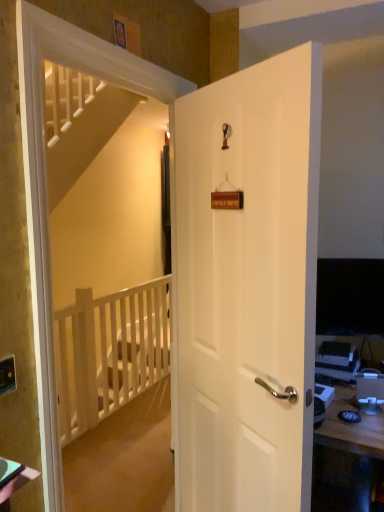
The image size is (384, 512). Describe the element at coordinates (370, 392) in the screenshot. I see `matte black desktop computer at right` at that location.

Image resolution: width=384 pixels, height=512 pixels. What do you see at coordinates (247, 286) in the screenshot?
I see `white matte door at center` at bounding box center [247, 286].

Where is `white wooden balustrade at left`? white wooden balustrade at left is located at coordinates (109, 352).

This screenshot has width=384, height=512. Identify the location of matte black desktop computer at right. (370, 392).

Is matte black outlet at lower left to the right of white matte door at center from the viewer's perspective?

No.

Relative to white matte door at center, is matte black outlet at lower left in front or behind?

Clearly, matte black outlet at lower left is in front of white matte door at center.

Is matte black outlet at lower left inside the boundaries of white matte door at center, or outside?

The correct answer is: outside.

Can you confirm if matte black outlet at lower left is taller than white matte door at center?

Incorrect, the height of matte black outlet at lower left is not larger of that of white matte door at center.

Who is taller, white wooden balustrade at left or matte black desktop computer at right?

white wooden balustrade at left.

Consider the image. In terms of width, does white wooden balustrade at left look wider or thinner when compared to matte black desktop computer at right?

In the image, white wooden balustrade at left appears to be wider than matte black desktop computer at right.

Is white wooden balustrade at left far from matte black desktop computer at right?

Yes, white wooden balustrade at left and matte black desktop computer at right are located far from each other.

How different are the orientations of white wooden balustrade at left and matte black desktop computer at right in degrees?

white wooden balustrade at left and matte black desktop computer at right are facing 72.8 degrees away from each other.

Is matte black outlet at lower left positioned with its back to white wooden balustrade at left?

No, white wooden balustrade at left is not at the back of matte black outlet at lower left.

Can you confirm if matte black outlet at lower left is wider than white wooden balustrade at left?

No, matte black outlet at lower left is not wider than white wooden balustrade at left.

Between matte black outlet at lower left and white wooden balustrade at left, which one has larger size?

white wooden balustrade at left.

From a real-world perspective, which is physically above, matte black outlet at lower left or white wooden balustrade at left?

matte black outlet at lower left is physically above.

Based on the photo, visually, is white matte door at center positioned to the left or to the right of matte black desktop computer at right?

Based on their positions, white matte door at center is located to the left of matte black desktop computer at right.

This screenshot has height=512, width=384. I want to click on door lying above the matte black desktop computer at right (from the image's perspective), so click(x=247, y=286).

Is point (233, 509) positioned in front of point (375, 392)?

Yes, it is.

From the image's perspective, which is below, white matte door at center or matte black desktop computer at right?

matte black desktop computer at right is shown below in the image.

From the image's perspective, between white matte door at center and matte black outlet at lower left, which one is located above?

matte black outlet at lower left.

From a real-world perspective, which object rests below the other?

In real-world perspective, white matte door at center is lower.

Which object is positioned more to the right, white matte door at center or matte black outlet at lower left?

From the viewer's perspective, white matte door at center appears more on the right side.

Can you tell me how much white matte door at center and matte black outlet at lower left differ in facing direction?

They differ by 116 degrees in their facing directions.

Is white wooden balustrade at left taller than white matte door at center?

No, white wooden balustrade at left is not taller than white matte door at center.

Is white wooden balustrade at left aimed at white matte door at center?

Yes, white wooden balustrade at left is facing white matte door at center.

How much distance is there between white wooden balustrade at left and white matte door at center?

They are 4.91 feet apart.

Can you see white wooden balustrade at left touching white matte door at center?

No, white wooden balustrade at left is not beside white matte door at center.

Can you confirm if white wooden balustrade at left is smaller than matte black outlet at lower left?

Incorrect, white wooden balustrade at left is not smaller in size than matte black outlet at lower left.

Between point (166, 317) and point (15, 387), which one is positioned in front?

Positioned in front is point (15, 387).

Is white wooden balustrade at left taller or shorter than matte black outlet at lower left?

Considering their sizes, white wooden balustrade at left has more height than matte black outlet at lower left.

Between white wooden balustrade at left and matte black outlet at lower left, which one is positioned behind?

white wooden balustrade at left is further from the camera.

This screenshot has height=512, width=384. In the image, there is a matte black outlet at lower left. What are the coordinates of `door below it (from the image's perspective)` in the screenshot? It's located at (247, 286).

The image size is (384, 512). What are the coordinates of `balustrade on the left side of matte black desktop computer at right` in the screenshot? It's located at pos(109,352).

When comparing their distances from matte black desktop computer at right, does matte black outlet at lower left or white matte door at center seem closer?

white matte door at center.

From the image, which object appears to be nearer to matte black desktop computer at right, white matte door at center or white wooden balustrade at left?

white matte door at center.

Which object lies nearer to the anchor point matte black outlet at lower left, white matte door at center or matte black desktop computer at right?

white matte door at center lies closer to matte black outlet at lower left than the other object.

Estimate the real-world distances between objects in this image. Which object is further from white matte door at center, matte black outlet at lower left or white wooden balustrade at left?

Based on the image, white wooden balustrade at left appears to be further to white matte door at center.

Looking at the image, which one is located further to matte black outlet at lower left, white wooden balustrade at left or matte black desktop computer at right?

white wooden balustrade at left is positioned further to the anchor matte black outlet at lower left.

Which object lies nearer to the anchor point matte black outlet at lower left, white wooden balustrade at left or white matte door at center?

white matte door at center is closer to matte black outlet at lower left.

Looking at this image, estimate the real-world distances between objects in this image. Which object is further from white wooden balustrade at left, matte black outlet at lower left or white matte door at center?

matte black outlet at lower left is further to white wooden balustrade at left.

When comparing their distances from matte black desktop computer at right, does matte black outlet at lower left or white wooden balustrade at left seem further?

white wooden balustrade at left lies further to matte black desktop computer at right than the other object.

Where is `door between matte black outlet at lower left and matte black desktop computer at right in the horizontal direction`? The height and width of the screenshot is (512, 384). door between matte black outlet at lower left and matte black desktop computer at right in the horizontal direction is located at coordinates (247, 286).

I want to click on desktop computer between matte black outlet at lower left and white wooden balustrade at left from front to back, so click(370, 392).

You are a GUI agent. You are given a task and a screenshot of the screen. Output one action in this format:
    pyautogui.click(x=<x>, y=<y>)
    Task: Click on the door between matte black outlet at lower left and white wooden balustrade at left from front to back
    
    Given the screenshot: What is the action you would take?
    pyautogui.click(x=247, y=286)

Where is `desktop computer located between white matte door at center and white wooden balustrade at left in the depth direction`? The height and width of the screenshot is (512, 384). desktop computer located between white matte door at center and white wooden balustrade at left in the depth direction is located at coordinates (370, 392).